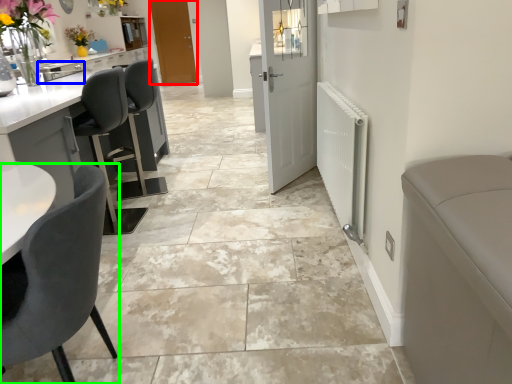
Question: Based on their relative distances, which object is farther from door (highlighted by a red box)? Choose from sink (highlighted by a blue box) and chair (highlighted by a green box).

Choices:
 (A) sink
 (B) chair

Answer: (B)